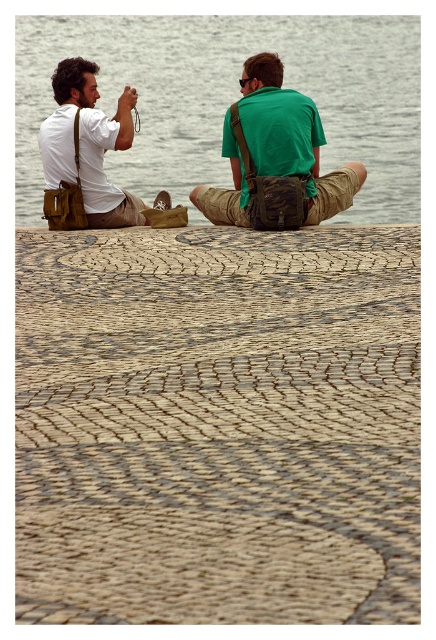
You are a photographer trying to capture the scene with your camera. You notice the gray water at center and the matte brown bag at left. Which object should you focus on if you want to capture the larger one in your shot?

The gray water at center is bigger than the matte brown bag at left, so you should focus on the gray water at center to capture the larger one in your shot.

You are a photographer trying to capture a closeup of the khaki fabric bag at center. You are standing at the point marked as point (x=275, y=157). Can you take the photo without moving from your current position?

The khaki fabric bag at center is located at point (x=275, y=157), so you are already at the exact location of the bag. You cannot take a closeup from this position as you would need to be at a different position to capture it.

You are planning to take a photo of the gray water at center and the khaki fabric bag at center. Which object should you focus on first if you want to capture both in a single frame without moving the camera?

Since the gray water at center is larger in size compared to the khaki fabric bag at center, you should focus on the gray water at center first to ensure it fits properly within the frame.